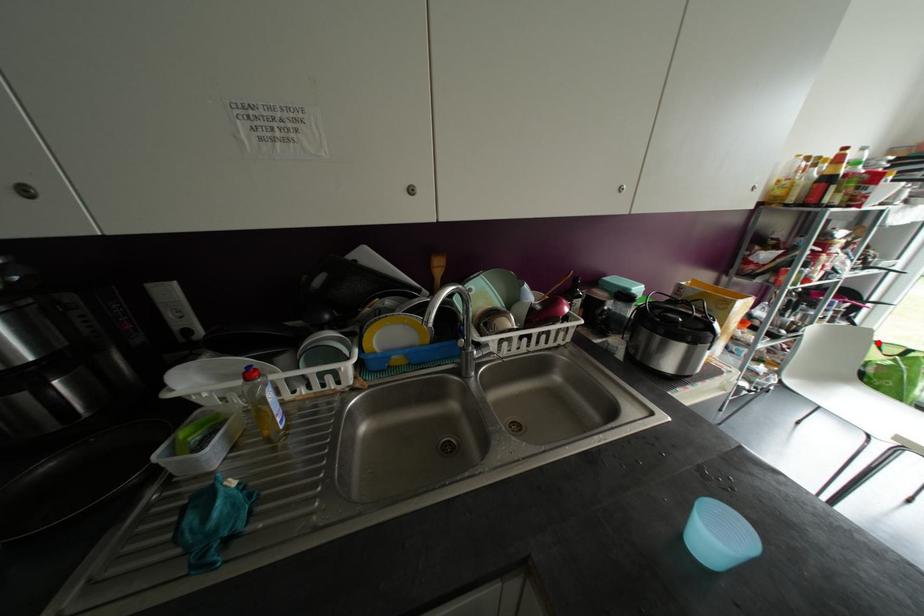
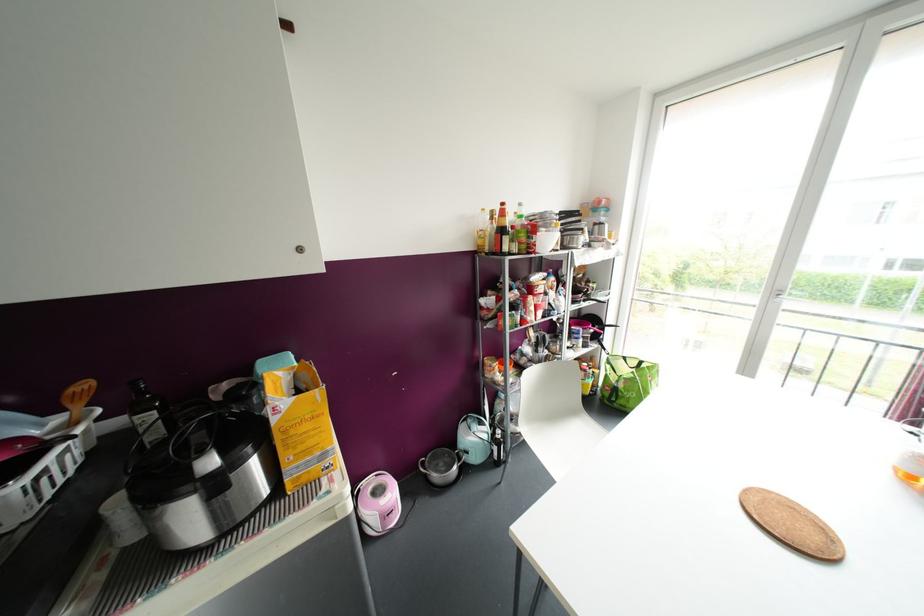
Find the pixel in the second image that matches the highlighted location in the first image.

(624, 358)